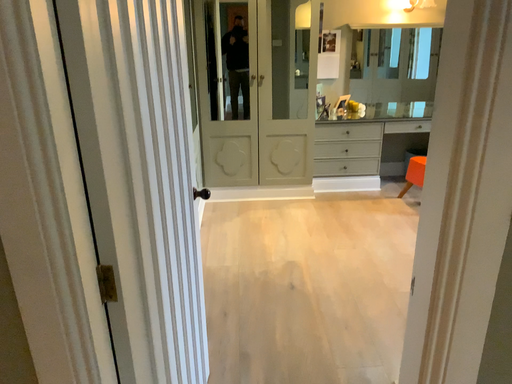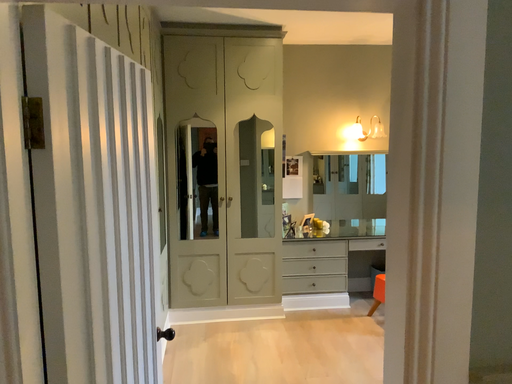
Question: Which way did the camera rotate in the video?

Choices:
 (A) rotated upward
 (B) rotated downward

Answer: (A)